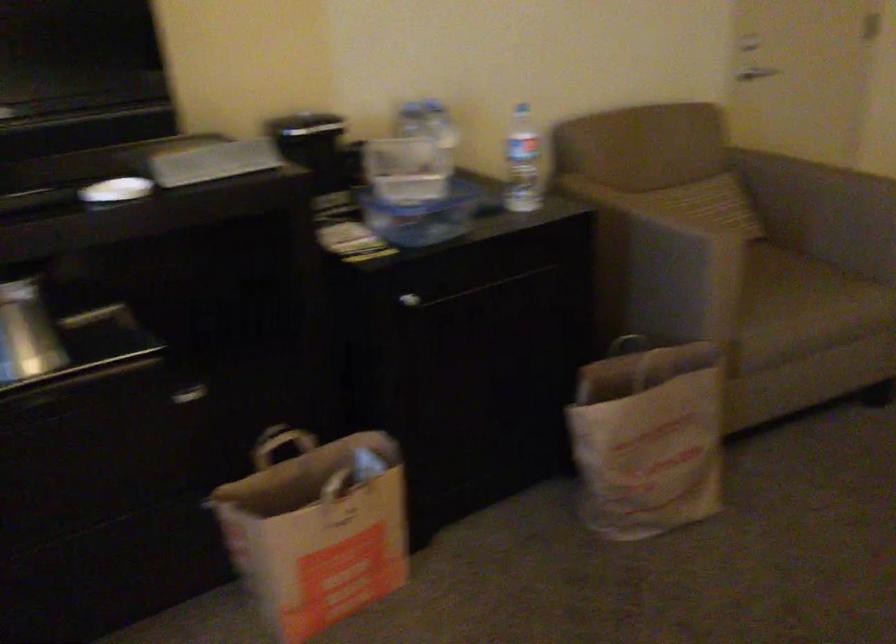
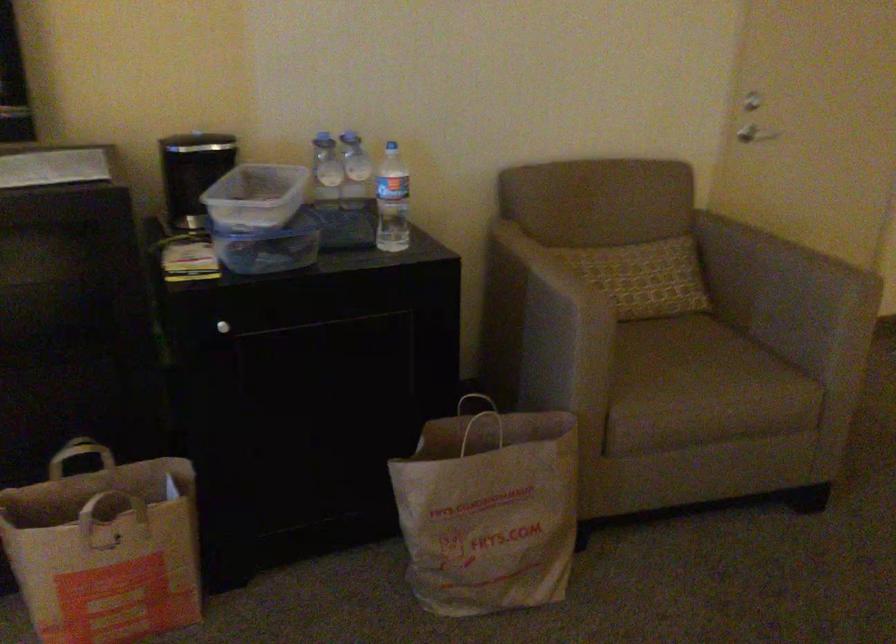
Find the pixel in the second image that matches point 524,160 in the first image.

(391, 201)